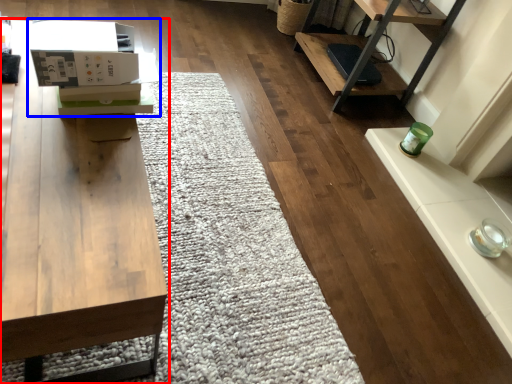
Question: Which point is closer to the camera, table (highlighted by a red box) or cardboard box (highlighted by a blue box)?

Choices:
 (A) table
 (B) cardboard box

Answer: (A)